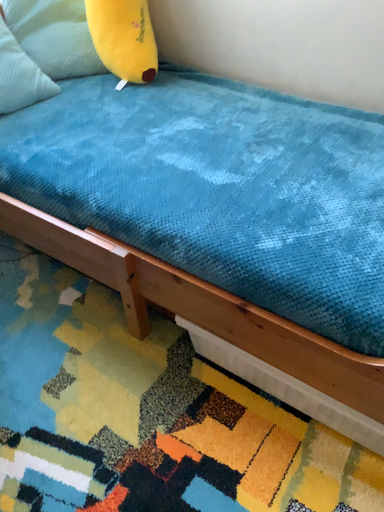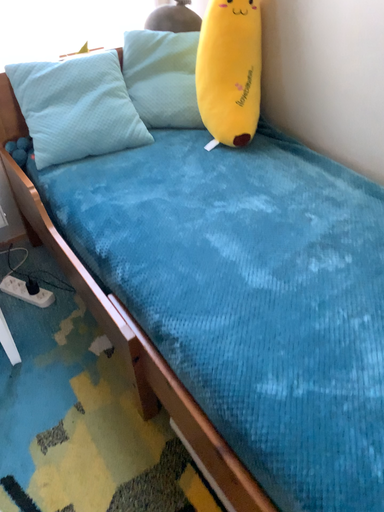
Question: How did the camera likely rotate when shooting the video?

Choices:
 (A) rotated right
 (B) rotated left

Answer: (B)